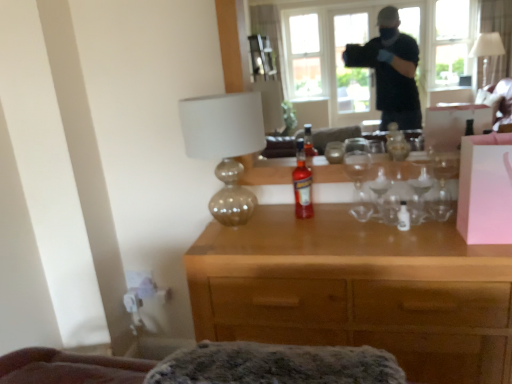
Question: Considering the relative positions of matte gold lamp at center and pink matte box at right in the image provided, is matte gold lamp at center behind pink matte box at right?

Choices:
 (A) yes
 (B) no

Answer: (A)

Question: Is matte gold lamp at center directly adjacent to pink matte box at right?

Choices:
 (A) yes
 (B) no

Answer: (B)

Question: Is matte gold lamp at center smaller than pink matte box at right?

Choices:
 (A) no
 (B) yes

Answer: (A)

Question: From the image's perspective, does matte gold lamp at center appear higher than pink matte box at right?

Choices:
 (A) yes
 (B) no

Answer: (A)

Question: Is matte gold lamp at center outside pink matte box at right?

Choices:
 (A) no
 (B) yes

Answer: (B)

Question: Is translucent glass bottle at center spatially inside pink matte box at right, or outside of it?

Choices:
 (A) inside
 (B) outside

Answer: (B)

Question: Is translucent glass bottle at center wider or thinner than pink matte box at right?

Choices:
 (A) thin
 (B) wide

Answer: (A)

Question: From a real-world perspective, is translucent glass bottle at center above or below pink matte box at right?

Choices:
 (A) above
 (B) below

Answer: (B)

Question: Considering the positions of point (295, 210) and point (502, 135), is point (295, 210) closer or farther from the camera than point (502, 135)?

Choices:
 (A) farther
 (B) closer

Answer: (A)

Question: Relative to pink matte box at right, is transparent glass window at upper center in front or behind?

Choices:
 (A) front
 (B) behind

Answer: (B)

Question: From the image's perspective, is transparent glass window at upper center positioned above or below pink matte box at right?

Choices:
 (A) below
 (B) above

Answer: (B)

Question: Considering the positions of transparent glass window at upper center and pink matte box at right in the image, is transparent glass window at upper center wider or thinner than pink matte box at right?

Choices:
 (A) thin
 (B) wide

Answer: (A)

Question: From a real-world perspective, is transparent glass window at upper center above or below pink matte box at right?

Choices:
 (A) above
 (B) below

Answer: (A)

Question: Is transparent glass window at upper center wider or thinner than wooden desk at center?

Choices:
 (A) wide
 (B) thin

Answer: (B)

Question: Relative to wooden desk at center, is transparent glass window at upper center in front or behind?

Choices:
 (A) behind
 (B) front

Answer: (A)